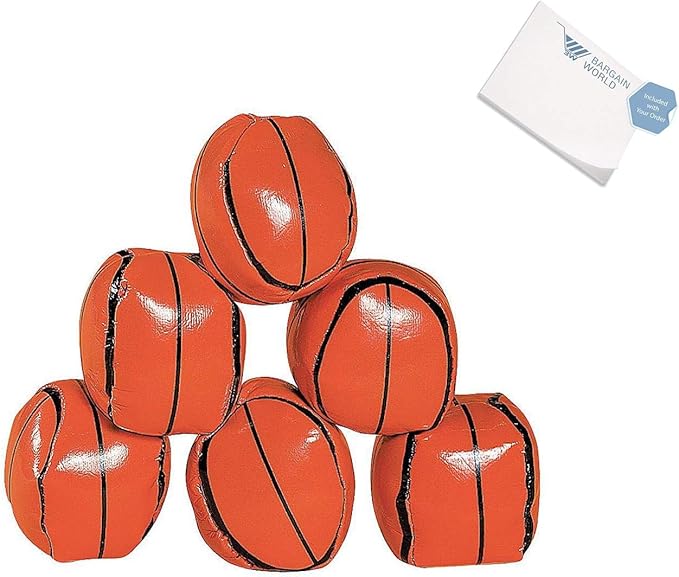
Identify the location of basketball bean bag. The height and width of the screenshot is (577, 679). (265, 202), (342, 308), (130, 353), (231, 467), (100, 464), (454, 518).